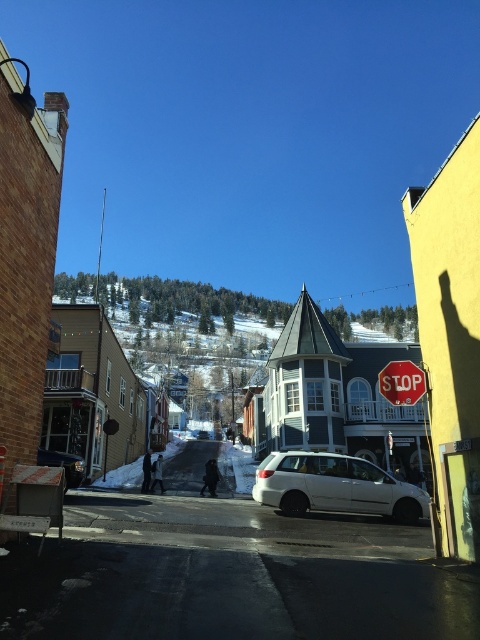
Question: Can you confirm if white matte van at center is positioned above red matte stop sign at lower right?

Choices:
 (A) yes
 (B) no

Answer: (B)

Question: Which of the following is the closest to the observer?

Choices:
 (A) (395, 502)
 (B) (358, 424)

Answer: (A)

Question: Is white matte van at center bigger than red matte stop sign at lower right?

Choices:
 (A) yes
 (B) no

Answer: (A)

Question: Does white matte building at center appear on the right side of red matte stop sign at lower right?

Choices:
 (A) no
 (B) yes

Answer: (A)

Question: Which object is the farthest from the white matte building at center?

Choices:
 (A) red matte stop sign at lower right
 (B) white matte van at center

Answer: (A)

Question: Among these points, which one is nearest to the camera?

Choices:
 (A) (147, 369)
 (B) (420, 388)

Answer: (B)